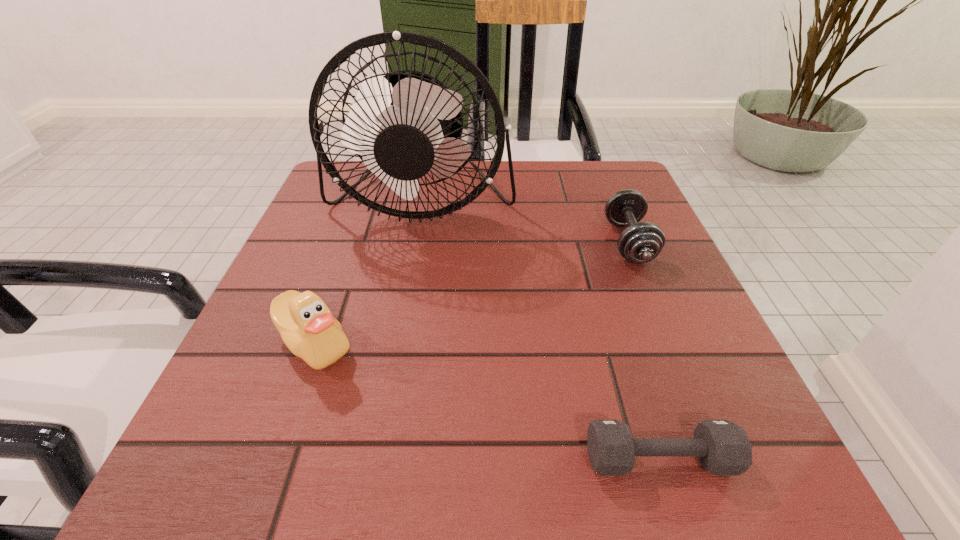
This screenshot has height=540, width=960. I want to click on vacant space at the right edge, so click(x=683, y=269).

Locate an element on the screen. free space at the far right corner of the desktop is located at coordinates (603, 183).

Locate an element on the screen. free point at the near right corner is located at coordinates (721, 489).

Image resolution: width=960 pixels, height=540 pixels. What are the coordinates of `unoccupied position between the nearest object and the fan` in the screenshot? It's located at (540, 330).

I want to click on free point between the taller dumbbell and the duck, so click(471, 293).

At what (x,y) coordinates should I click in order to perform the action: click on unoccupied position between the tallest object and the farther dumbbell. Please return your answer as a coordinate pair (x, y). Looking at the image, I should click on (525, 221).

Where is `vacant space in between the duck and the nearest object`? The height and width of the screenshot is (540, 960). vacant space in between the duck and the nearest object is located at coordinates (487, 401).

Where is `free area in between the third farthest object and the tallest object`? The width and height of the screenshot is (960, 540). free area in between the third farthest object and the tallest object is located at coordinates (369, 272).

This screenshot has width=960, height=540. I want to click on vacant point located between the nearer dumbbell and the third shortest object, so 487,401.

Where is `blank region between the duck and the fan`? This screenshot has width=960, height=540. blank region between the duck and the fan is located at coordinates (369, 272).